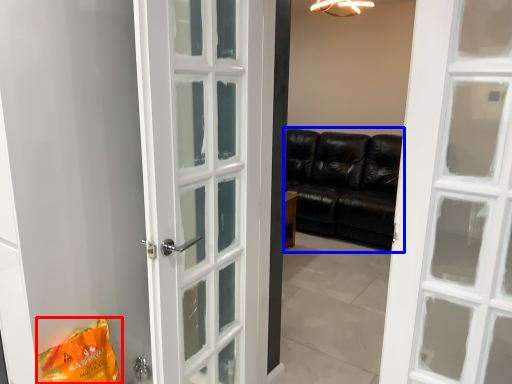
Question: Which object is closer to the camera taking this photo, shopping bag (highlighted by a red box) or studio couch (highlighted by a blue box)?

Choices:
 (A) shopping bag
 (B) studio couch

Answer: (A)